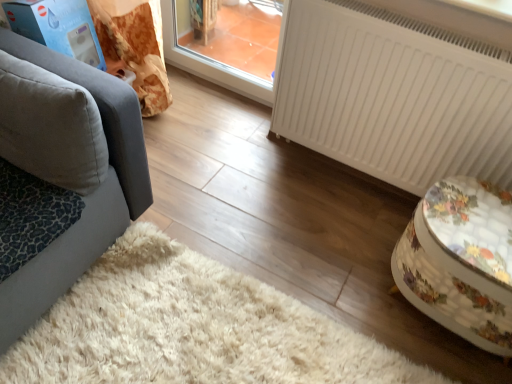
In order to click on empty space that is ontop of floral fabric ottoman at right (from a real-world perspective) in this screenshot , I will do tap(475, 217).